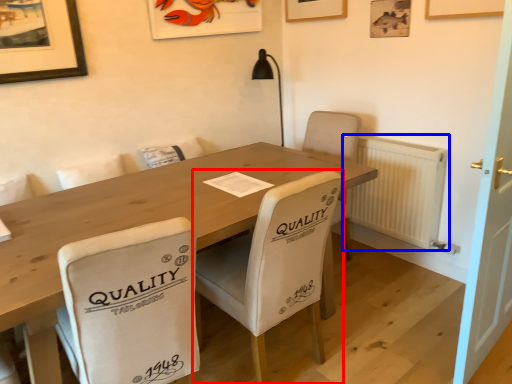
Question: Which point is closer to the camera, chair (highlighted by a red box) or radiator (highlighted by a blue box)?

Choices:
 (A) chair
 (B) radiator

Answer: (A)